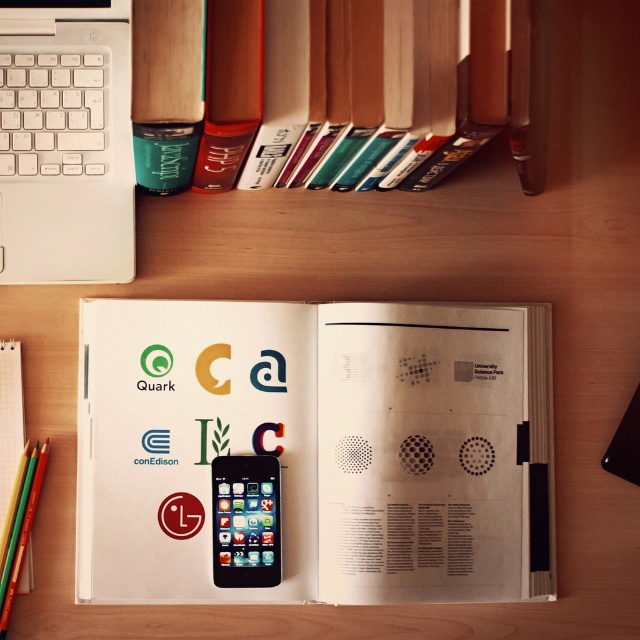
The image size is (640, 640). Describe the element at coordinates (65, 141) in the screenshot. I see `white matte laptop at upper left` at that location.

Who is higher up, white matte laptop at upper left or black matte smartphone at center?

Positioned higher is white matte laptop at upper left.

Is point (38, 97) more distant than point (275, 493)?

Yes.

You are a GUI agent. You are given a task and a screenshot of the screen. Output one action in this format:
    pyautogui.click(x=<x>, y=<y>)
    Task: Click on the white matte laptop at upper left
    
    Given the screenshot: What is the action you would take?
    pyautogui.click(x=65, y=141)

Can you confirm if white paper at center is positioned above black matte smartphone at center?

Indeed, white paper at center is positioned over black matte smartphone at center.

Is point (298, 557) farther from viewer compared to point (227, 504)?

That is True.

I want to click on white paper at center, so click(x=314, y=451).

Between white matte laptop at upper left and teal matte cup at upper left, which one has more height?

With more height is white matte laptop at upper left.

Is white matte laptop at upper left below teal matte cup at upper left?

Yes.

Between point (26, 172) and point (532, 93), which one is positioned behind?

The point (532, 93) is more distant.

I want to click on white matte laptop at upper left, so click(65, 141).